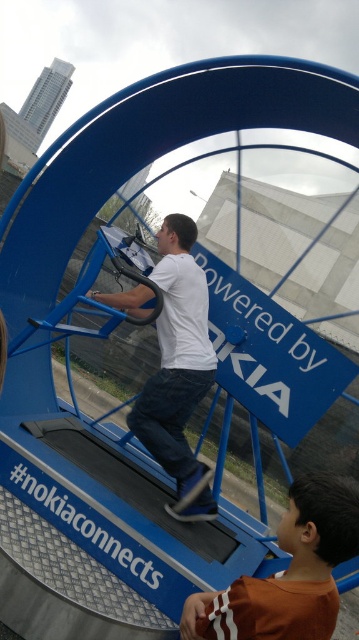
Does point (292, 483) come closer to viewer compared to point (188, 243)?

Yes.

Is brown cotton shirt at lower right closer to the viewer compared to white matte shirt at center?

Yes, brown cotton shirt at lower right is in front of white matte shirt at center.

Does point (299, 520) lie behind point (171, 420)?

No, it is in front of (171, 420).

Find the location of a particular element. brown cotton shirt at lower right is located at coordinates (287, 572).